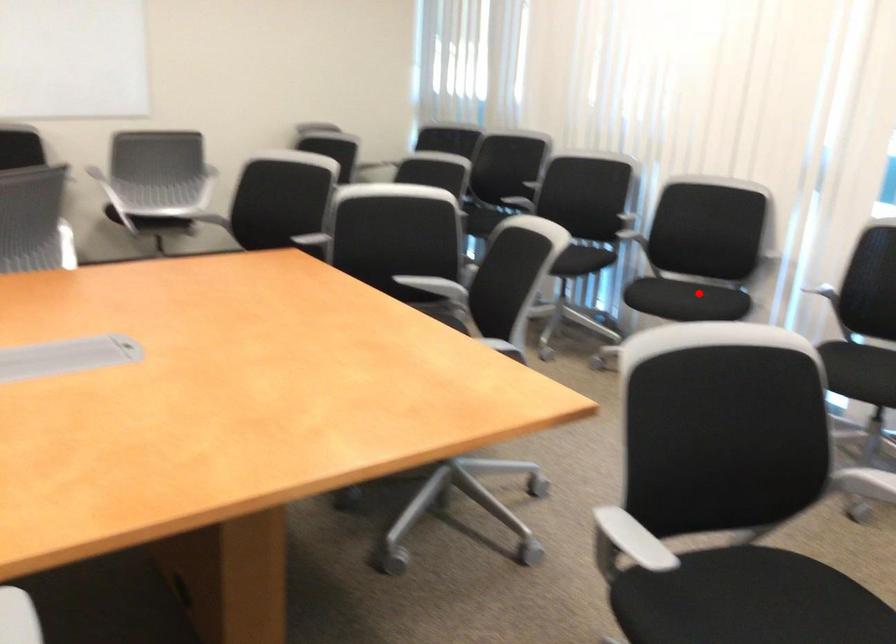
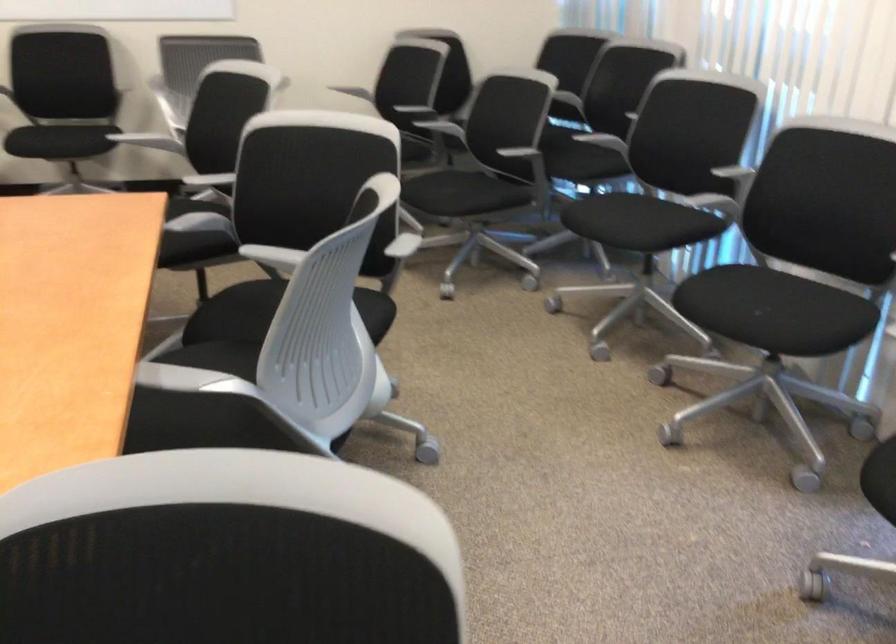
Question: A red point is marked in image1. In image2, is the corresponding 3D point closer to the camera or farther? Reply with the corresponding letter.

Choices:
 (A) The corresponding 3D point is closer.
 (B) The corresponding 3D point is farther.

Answer: (A)